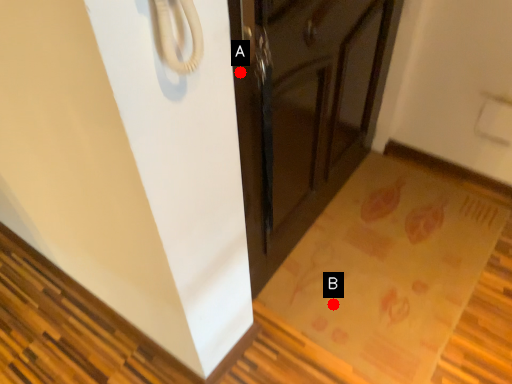
Question: Two points are circled on the image, labeled by A and B beside each circle. Among these points, which one is farthest from the camera?

Choices:
 (A) A is further
 (B) B is further

Answer: (B)